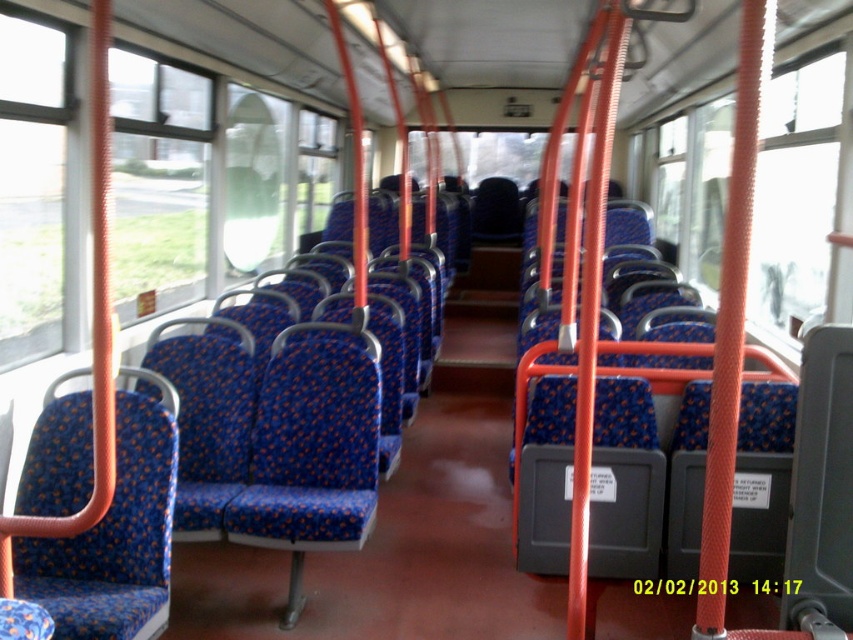
Does transparent glass window at center come behind transparent glass window at upper left?

No, transparent glass window at center is closer to the viewer.

Find the location of a particular element. transparent glass window at center is located at coordinates (799, 186).

I want to click on transparent glass window at center, so click(x=799, y=186).

Is transparent glass window at center positioned behind transparent glass window at left?

Yes, it is.

Between transparent glass window at center and transparent glass window at left, which one appears on the left side from the viewer's perspective?

transparent glass window at left is more to the left.

Is point (840, 102) more distant than point (53, 248)?

No.

Where is `transparent glass window at center`? Image resolution: width=853 pixels, height=640 pixels. transparent glass window at center is located at coordinates (799, 186).

In the scene shown: Between transparent glass window at upper left and transparent glass window at left, which one has more height?

Standing taller between the two is transparent glass window at upper left.

Measure the distance between transparent glass window at upper left and camera.

transparent glass window at upper left is 3.48 meters away from camera.

The image size is (853, 640). I want to click on transparent glass window at upper left, so coord(158,182).